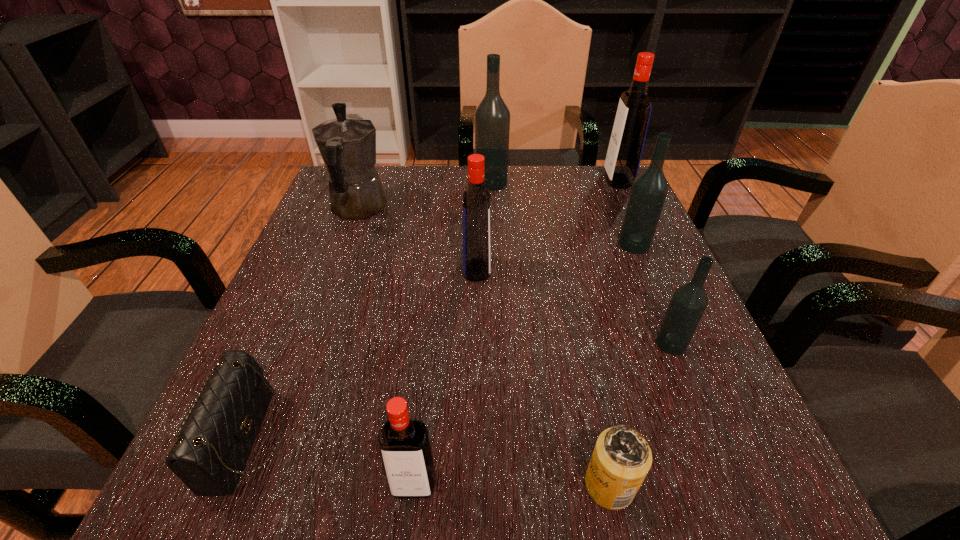
I want to click on vacant region at the far right corner of the desktop, so click(627, 194).

Identify the location of free space at the near right corner of the desktop. (687, 515).

The width and height of the screenshot is (960, 540). I want to click on empty space that is in between the clutch bag and the second farthest red vodka, so click(x=362, y=355).

Image resolution: width=960 pixels, height=540 pixels. In order to click on empty space that is in between the coffeepot and the smallest red vodka in this screenshot , I will do `click(386, 347)`.

What are the coordinates of `free space between the second smallest black vodka and the clutch bag` in the screenshot? It's located at (441, 342).

I want to click on free space between the fifth farthest object and the rightmost red vodka, so click(547, 225).

Where is `vacant space in between the beer can and the biggest black vodka`? The width and height of the screenshot is (960, 540). vacant space in between the beer can and the biggest black vodka is located at coordinates (550, 334).

Locate an element on the screen. This screenshot has width=960, height=540. unoccupied position between the clutch bag and the farthest red vodka is located at coordinates (433, 310).

This screenshot has width=960, height=540. I want to click on vacant point located between the second smallest red vodka and the biggest red vodka, so click(547, 225).

This screenshot has width=960, height=540. I want to click on blank region between the coffeepot and the third farthest vodka, so click(x=496, y=227).